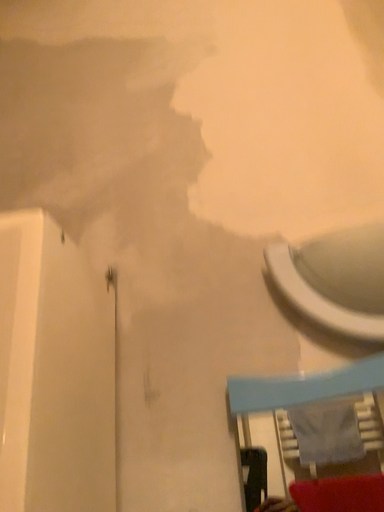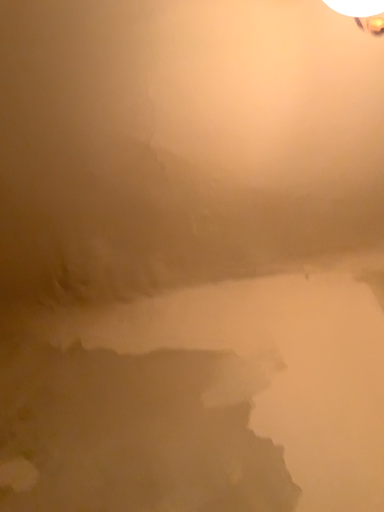
Question: Which way did the camera rotate in the video?

Choices:
 (A) rotated upward
 (B) rotated downward

Answer: (A)